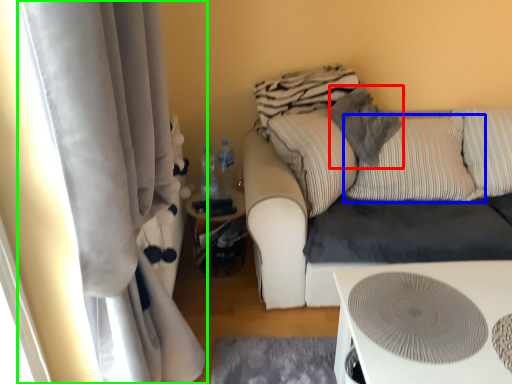
Question: Which is nearer to the pillow (highlighted by a red box)? pillow (highlighted by a blue box) or curtain (highlighted by a green box).

Choices:
 (A) pillow
 (B) curtain

Answer: (A)